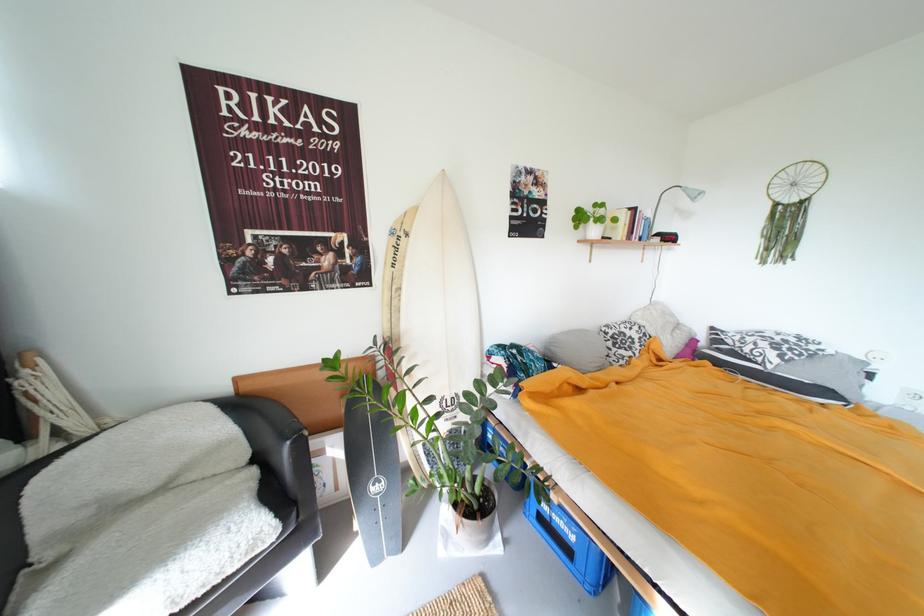
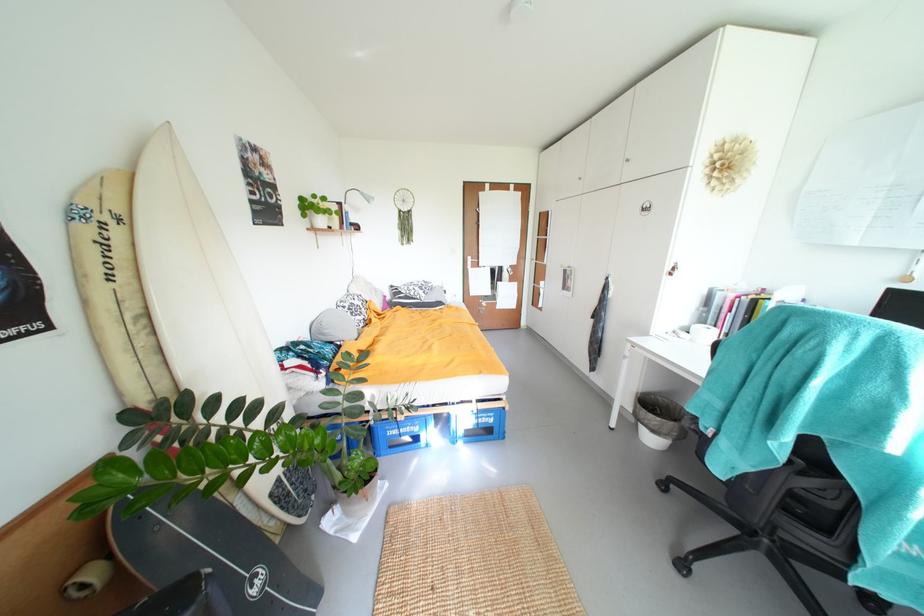
The point at (x=580, y=535) is marked in the first image. Where is the corresponding point in the second image?

(423, 428)